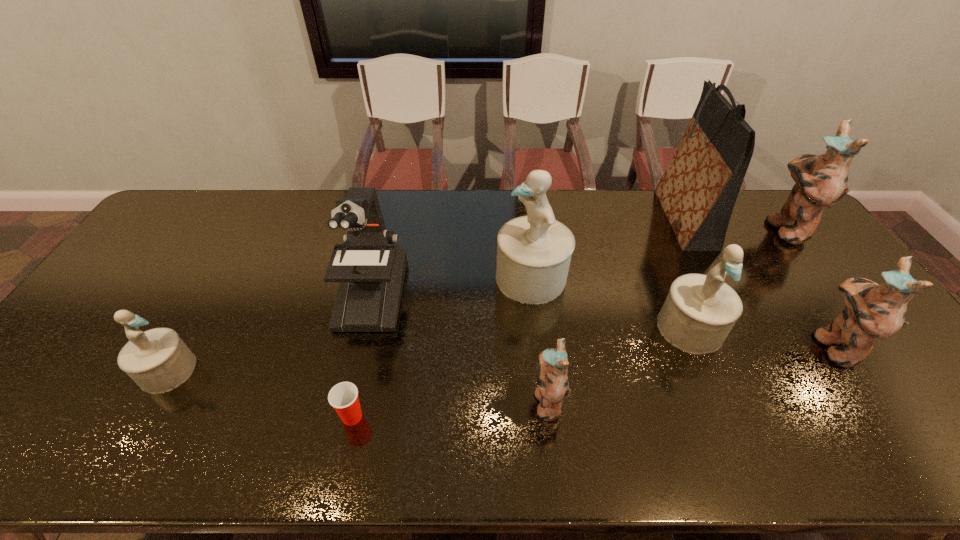
Identify the location of object identified as the seventh closest to the biggest white figurine. The width and height of the screenshot is (960, 540). (821, 181).

Select which object is the eighth closest to the second white figurine from right to left. Please provide its 2D coordinates. Your answer should be formatted as a tuple, i.e. [(x, y)], where the tuple contains the x and y coordinates of a point satisfying the conditions above.

[(157, 360)]

The height and width of the screenshot is (540, 960). Identify the location of the third closest figurine relative to the second biggest pink figurine. (534, 252).

Locate which figurine is the second closest to the second smallest white figurine. Please provide its 2D coordinates. Your answer should be formatted as a tuple, i.e. [(x, y)], where the tuple contains the x and y coordinates of a point satisfying the conditions above.

[(872, 311)]

Locate an element on the screen. This screenshot has width=960, height=540. white figurine that stands as the closest to the second white figurine from left to right is located at coordinates (700, 310).

Point out which white figurine is positioned as the second nearest to the second white figurine from left to right. Please provide its 2D coordinates. Your answer should be formatted as a tuple, i.e. [(x, y)], where the tuple contains the x and y coordinates of a point satisfying the conditions above.

[(157, 360)]

Locate an element on the screen. This screenshot has height=540, width=960. pink figurine that is the closest to the shortest object is located at coordinates (552, 365).

Locate an element on the screen. Image resolution: width=960 pixels, height=540 pixels. pink figurine object that ranks as the second closest to the red Dixie cup is located at coordinates (872, 311).

You are a GUI agent. You are given a task and a screenshot of the screen. Output one action in this format:
    pyautogui.click(x=<x>, y=<y>)
    Task: Click on the free spot that satisfies the following two spatial constraints: 1. on the front-facing side of the tallest object; 2. at the beak of the second smallest white figurine
    The height and width of the screenshot is (540, 960).
    Given the screenshot: What is the action you would take?
    pyautogui.click(x=738, y=328)

The image size is (960, 540). I want to click on vacant space that satisfies the following two spatial constraints: 1. at the beak of the second biggest white figurine; 2. at the beak of the leftmost figurine, so click(708, 370).